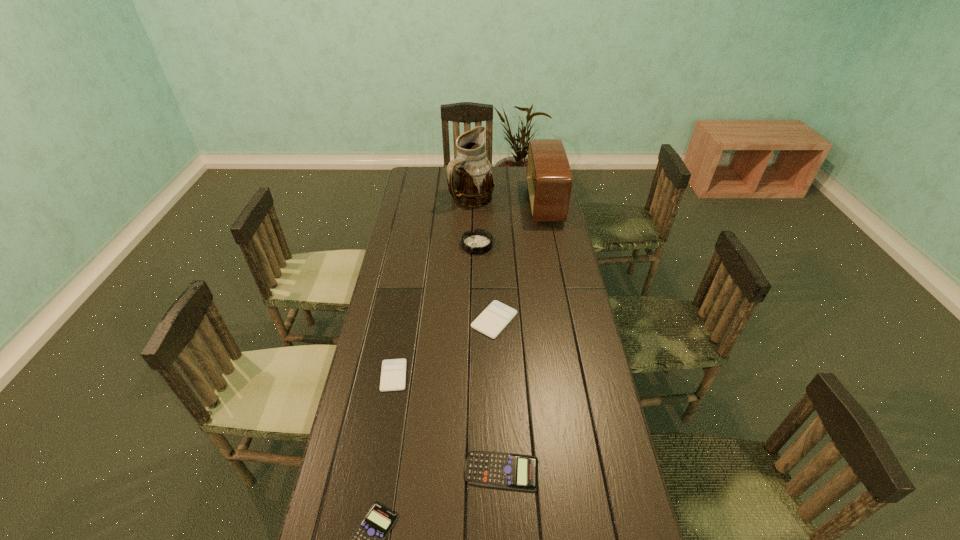
Locate an element on the screen. pitcher that is at the far edge is located at coordinates (470, 181).

The width and height of the screenshot is (960, 540). Identify the location of radio receiver situated at the far edge. (549, 179).

Identify the location of object that is at the left edge. This screenshot has width=960, height=540. (393, 373).

The image size is (960, 540). In order to click on object located in the right edge section of the desktop in this screenshot , I will do `click(549, 179)`.

Where is `object present at the far right corner`? The image size is (960, 540). object present at the far right corner is located at coordinates (549, 179).

Locate an element on the screen. The width and height of the screenshot is (960, 540). vacant space at the left edge of the desktop is located at coordinates (412, 237).

In the image, there is a desktop. What are the coordinates of `vacant space at the right edge` in the screenshot? It's located at (540, 254).

I want to click on vacant point located between the sixth farthest object and the radio receiver, so click(523, 338).

Identify the location of free space that is in between the farther blue calculator and the fourth tallest object. (498, 396).

Find the location of a particular element. This screenshot has height=540, width=960. free point between the dark ashtray and the left white calculator is located at coordinates (436, 310).